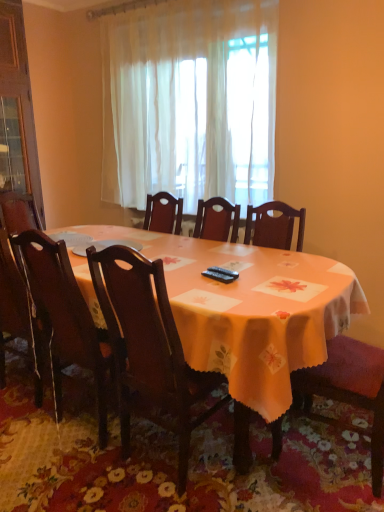
Find the location of a particular element. This screenshot has width=384, height=512. free space in front of dark wood chair at left, the 3th chair positioned from the right is located at coordinates point(64,479).